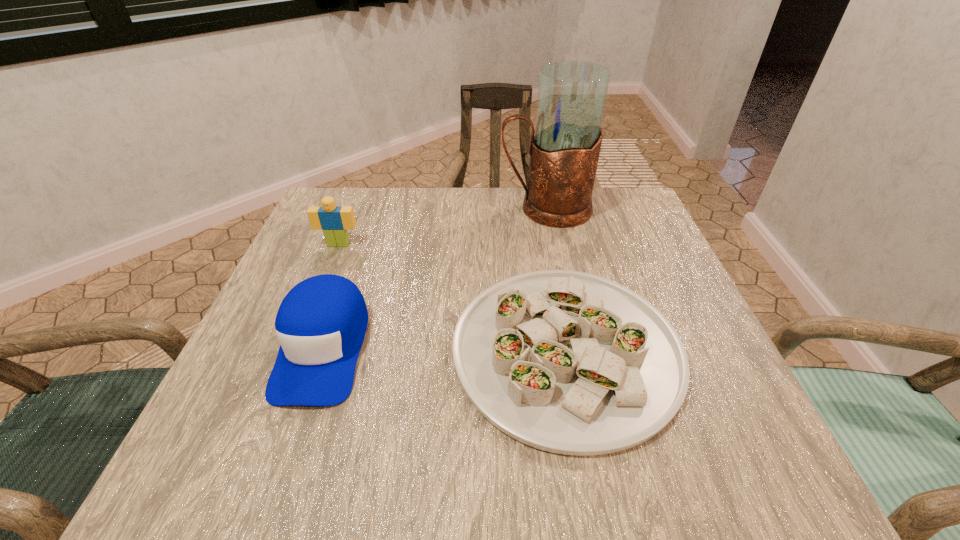
You are a GUI agent. You are given a task and a screenshot of the screen. Output one action in this format:
    pyautogui.click(x=<x>, y=<y>)
    Task: Click on the vacant region between the shortest object and the Lego
    The image size is (960, 540).
    Given the screenshot: What is the action you would take?
    pyautogui.click(x=452, y=297)

Select which object appears as the closest to the farthest object. Please provide its 2D coordinates. Your answer should be formatted as a tuple, i.e. [(x, y)], where the tuple contains the x and y coordinates of a point satisfying the conditions above.

[(568, 362)]

Identify the location of object that stands as the second closest to the Lego. This screenshot has height=540, width=960. (568, 362).

The height and width of the screenshot is (540, 960). In order to click on free location that satisfies the following two spatial constraints: 1. on the front-facing side of the shortest object; 2. on the right side of the baseball cap in this screenshot , I will do `click(323, 350)`.

I want to click on free location that satisfies the following two spatial constraints: 1. with the handle on the side of the farthest object; 2. on the face of the Lego, so click(x=553, y=244).

The image size is (960, 540). I want to click on vacant space that satisfies the following two spatial constraints: 1. on the face of the Lego; 2. on the left side of the platter, so click(296, 350).

Where is `free space that satisfies the following two spatial constraints: 1. with the handle on the side of the tallest object; 2. on the front-facing side of the baseball cap`? free space that satisfies the following two spatial constraints: 1. with the handle on the side of the tallest object; 2. on the front-facing side of the baseball cap is located at coordinates (574, 347).

Locate an element on the screen. This screenshot has height=540, width=960. free space in the image that satisfies the following two spatial constraints: 1. on the front-facing side of the baseball cap; 2. on the right side of the shortest object is located at coordinates (323, 350).

What are the coordinates of `vacant point that satisfies the following two spatial constraints: 1. with the handle on the side of the pitcher; 2. on the face of the third nearest object` in the screenshot? It's located at (553, 244).

Find the location of `blank space that satisfies the following two spatial constraints: 1. on the face of the second farthest object; 2. on the right side of the platter`. blank space that satisfies the following two spatial constraints: 1. on the face of the second farthest object; 2. on the right side of the platter is located at coordinates (296, 350).